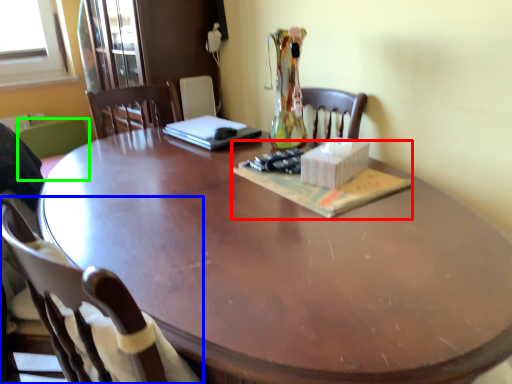
Question: Considering the real-world distances, which object is closest to magazine (highlighted by a red box)? chair (highlighted by a blue box) or chair (highlighted by a green box).

Choices:
 (A) chair
 (B) chair

Answer: (A)